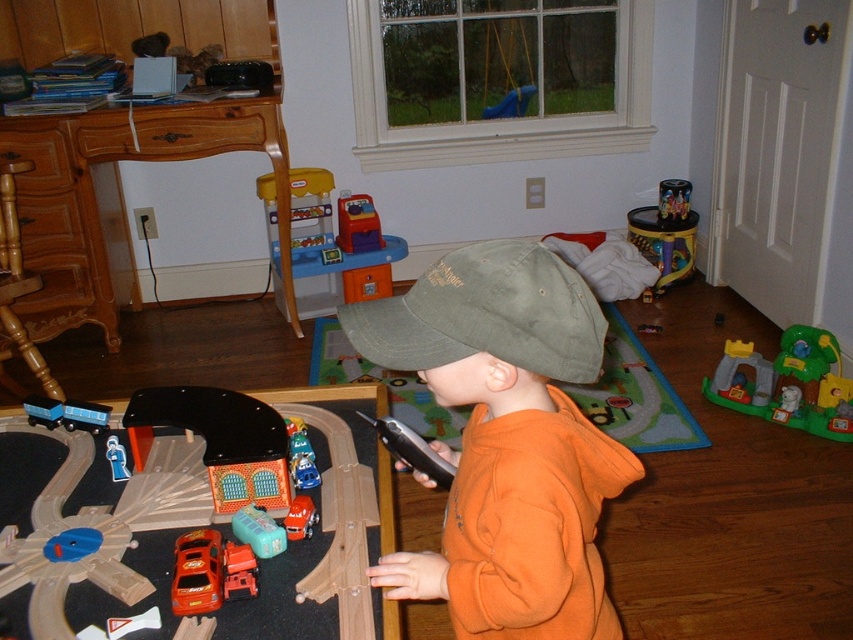
Question: Is black plastic train at left smaller than rubberized plastic toy car at center?

Choices:
 (A) no
 (B) yes

Answer: (A)

Question: Which object appears farthest from the camera in this image?

Choices:
 (A) rubberized plastic toy car at center
 (B) matte plastic train car at left

Answer: (A)

Question: Does green plastic playset at lower right have a smaller size compared to shiny metallic bucket at center right?

Choices:
 (A) yes
 (B) no

Answer: (B)

Question: Which object is the closest to the green plastic playset at lower right?

Choices:
 (A) black plastic train at left
 (B) smooth plastic car at center
 (C) rubberized plastic toy car at center

Answer: (C)

Question: Which point appears farthest from the camera in this image?

Choices:
 (A) (283, 518)
 (B) (398, 307)

Answer: (A)

Question: Can you confirm if orange fleece sweatshirt at center is positioned to the right of black plastic train at left?

Choices:
 (A) no
 (B) yes

Answer: (B)